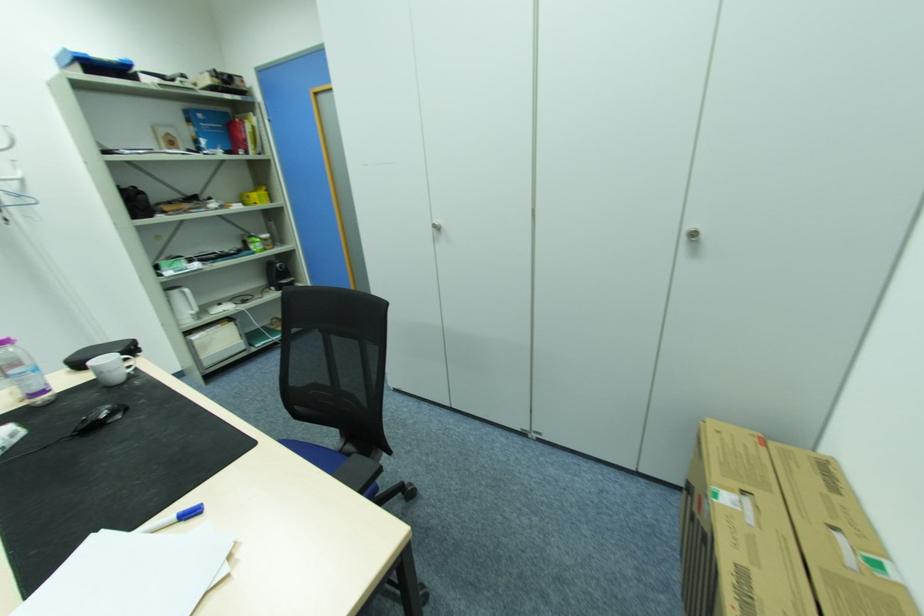
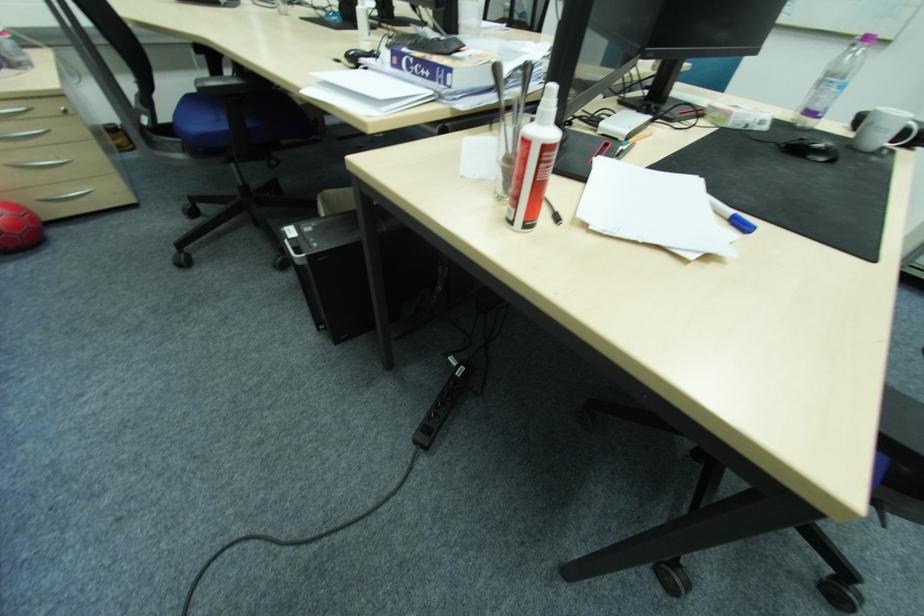
The first image is from the beginning of the video and the second image is from the end. How did the camera likely rotate when shooting the video?

The camera rotated toward left-down.